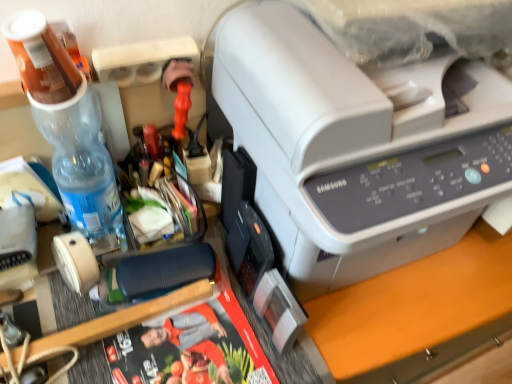
Question: Does translucent plastic bottle at upper left have a larger size compared to matte black magazine at center?

Choices:
 (A) yes
 (B) no

Answer: (B)

Question: Can you confirm if translucent plastic bottle at upper left is smaller than matte black magazine at center?

Choices:
 (A) no
 (B) yes

Answer: (B)

Question: Is translucent plastic bottle at upper left at the right side of matte black magazine at center?

Choices:
 (A) no
 (B) yes

Answer: (A)

Question: Considering the relative positions of translucent plastic bottle at upper left and matte black magazine at center in the image provided, is translucent plastic bottle at upper left to the left of matte black magazine at center from the viewer's perspective?

Choices:
 (A) no
 (B) yes

Answer: (B)

Question: Would you say translucent plastic bottle at upper left contains matte black magazine at center?

Choices:
 (A) yes
 (B) no

Answer: (B)

Question: In terms of height, does beige matte tape at lower left look taller or shorter compared to clear plastic bottle at left?

Choices:
 (A) short
 (B) tall

Answer: (A)

Question: From the image's perspective, is beige matte tape at lower left located above or below clear plastic bottle at left?

Choices:
 (A) above
 (B) below

Answer: (B)

Question: Looking at their shapes, would you say beige matte tape at lower left is wider or thinner than clear plastic bottle at left?

Choices:
 (A) wide
 (B) thin

Answer: (B)

Question: Is point (80, 253) positioned closer to the camera than point (88, 160)?

Choices:
 (A) farther
 (B) closer

Answer: (A)

Question: Does point click(75, 271) appear closer or farther from the camera than point click(211, 350)?

Choices:
 (A) closer
 (B) farther

Answer: (A)

Question: From their relative heights in the image, would you say beige matte tape at lower left is taller or shorter than matte black magazine at center?

Choices:
 (A) short
 (B) tall

Answer: (B)

Question: Would you say beige matte tape at lower left is inside or outside matte black magazine at center?

Choices:
 (A) outside
 (B) inside

Answer: (A)

Question: In the image, is beige matte tape at lower left on the left side or the right side of matte black magazine at center?

Choices:
 (A) left
 (B) right

Answer: (A)

Question: Does point (47, 94) appear closer or farther from the camera than point (69, 246)?

Choices:
 (A) farther
 (B) closer

Answer: (B)

Question: Considering the positions of clear plastic bottle at left and beige matte tape at lower left in the image, is clear plastic bottle at left wider or thinner than beige matte tape at lower left?

Choices:
 (A) wide
 (B) thin

Answer: (A)